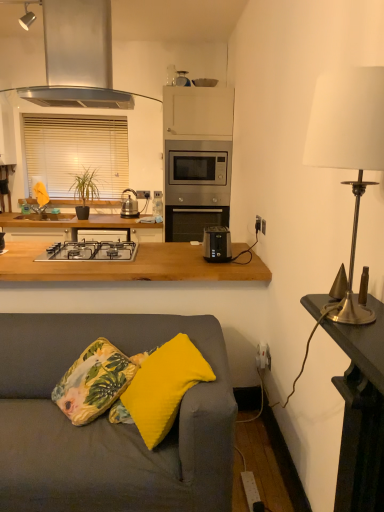
The image size is (384, 512). Find the location of `free space to the left of black plastic toaster at center`. free space to the left of black plastic toaster at center is located at coordinates (188, 252).